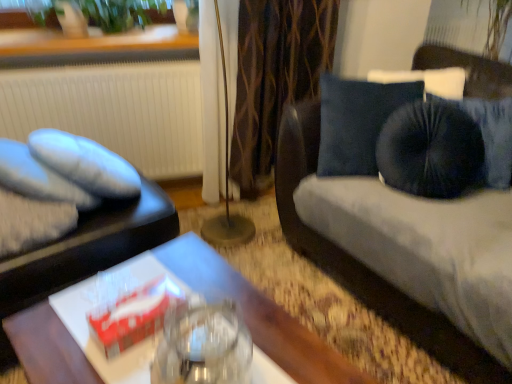
Question: Is green leafy plant at upper left inside matte black tray at left?

Choices:
 (A) yes
 (B) no

Answer: (B)

Question: Is matte black tray at left wider than green leafy plant at upper left?

Choices:
 (A) no
 (B) yes

Answer: (B)

Question: Is matte black tray at left shorter than green leafy plant at upper left?

Choices:
 (A) no
 (B) yes

Answer: (A)

Question: From the image's perspective, would you say matte black tray at left is positioned over green leafy plant at upper left?

Choices:
 (A) yes
 (B) no

Answer: (B)

Question: From the image's perspective, would you say matte black tray at left is shown under green leafy plant at upper left?

Choices:
 (A) yes
 (B) no

Answer: (A)

Question: Could you tell me if matte black tray at left is facing green leafy plant at upper left?

Choices:
 (A) yes
 (B) no

Answer: (B)

Question: From the image's perspective, is wooden table at center over metallic gold floor lamp at center?

Choices:
 (A) yes
 (B) no

Answer: (B)

Question: Does wooden table at center have a greater height compared to metallic gold floor lamp at center?

Choices:
 (A) no
 (B) yes

Answer: (A)

Question: Does wooden table at center have a lesser width compared to metallic gold floor lamp at center?

Choices:
 (A) yes
 (B) no

Answer: (B)

Question: Is wooden table at center shorter than metallic gold floor lamp at center?

Choices:
 (A) yes
 (B) no

Answer: (A)

Question: From a real-world perspective, is wooden table at center on metallic gold floor lamp at center?

Choices:
 (A) no
 (B) yes

Answer: (A)

Question: Can you confirm if wooden table at center is bigger than metallic gold floor lamp at center?

Choices:
 (A) no
 (B) yes

Answer: (B)

Question: Considering the relative positions of wooden table at center and green leafy plant at upper left in the image provided, is wooden table at center in front of green leafy plant at upper left?

Choices:
 (A) yes
 (B) no

Answer: (A)